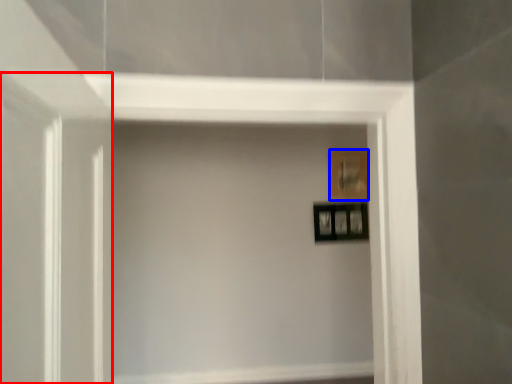
Question: Which object appears farthest to the camera in this image, glass door (highlighted by a red box) or picture frame (highlighted by a blue box)?

Choices:
 (A) glass door
 (B) picture frame

Answer: (B)